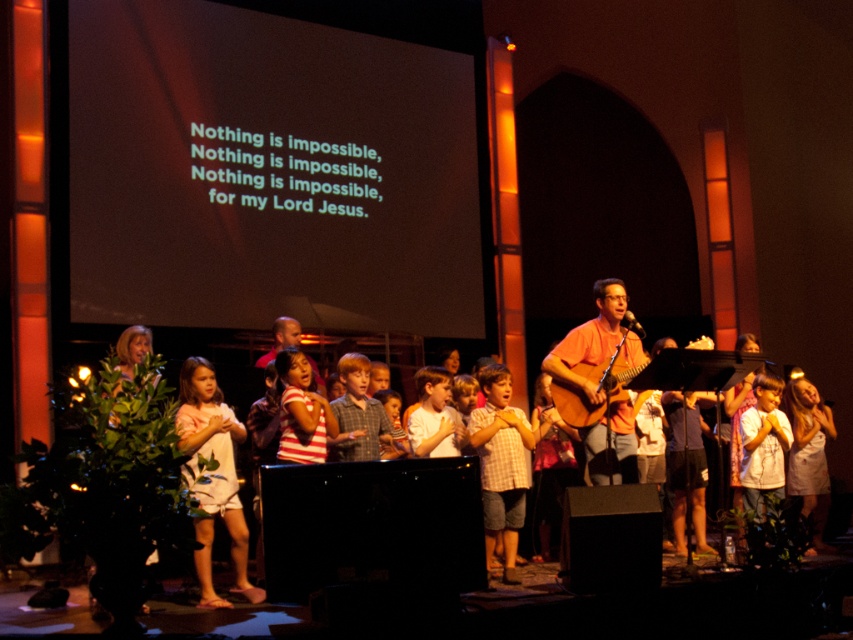
You are a photographer standing at the back of the stage. You want to take a photo of both the pink cotton dress at center and the checkered fabric shirt at center in the same frame. Given that your camera has a minimum focus distance of 1.5 meters, will you be able to capture both subjects clearly?

The distance between the pink cotton dress at center and the checkered fabric shirt at center is 1.73 meters, which is greater than the camera minimum focus distance of 1.5 meters. Therefore, the photographer can capture both subjects clearly.

Looking at this image, you are a photographer standing at the back of the church. You need to take a photo of the checkered fabric shirt at center and the smooth brown shirt at center so that both are clearly visible. Given their heights, which shirt should you focus on to ensure the shorter one isn

The checkered fabric shirt at center is much taller than the smooth brown shirt at center. To ensure the shorter smooth brown shirt at center is visible, focus on positioning the camera so the taller checkered fabric shirt at center doesn